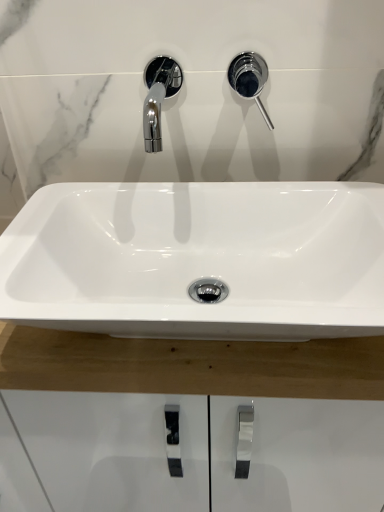
Question: Is polished chrome faucet at upper right surrounding white glossy sink at center?

Choices:
 (A) yes
 (B) no

Answer: (B)

Question: Can you confirm if polished chrome faucet at upper right is bigger than white glossy sink at center?

Choices:
 (A) yes
 (B) no

Answer: (B)

Question: Does polished chrome faucet at upper right turn towards white glossy sink at center?

Choices:
 (A) no
 (B) yes

Answer: (A)

Question: From a real-world perspective, is polished chrome faucet at upper right positioned under white glossy sink at center based on gravity?

Choices:
 (A) yes
 (B) no

Answer: (B)

Question: Can you confirm if polished chrome faucet at upper right is smaller than white glossy sink at center?

Choices:
 (A) no
 (B) yes

Answer: (B)

Question: From the image's perspective, is polished chrome faucet at upper right under white glossy sink at center?

Choices:
 (A) no
 (B) yes

Answer: (A)

Question: From a real-world perspective, is white glossy sink at center positioned over polished chrome faucet at upper right based on gravity?

Choices:
 (A) no
 (B) yes

Answer: (A)

Question: Is white glossy sink at center facing away from polished chrome faucet at upper right?

Choices:
 (A) yes
 (B) no

Answer: (B)

Question: Can you confirm if white glossy sink at center is thinner than polished chrome faucet at upper right?

Choices:
 (A) no
 (B) yes

Answer: (A)

Question: Are white glossy sink at center and polished chrome faucet at upper right making contact?

Choices:
 (A) no
 (B) yes

Answer: (A)

Question: Can you confirm if white glossy sink at center is smaller than polished chrome faucet at upper right?

Choices:
 (A) no
 (B) yes

Answer: (A)

Question: Are white glossy sink at center and polished chrome faucet at upper right located far from each other?

Choices:
 (A) yes
 (B) no

Answer: (B)

Question: Considering the positions of polished chrome faucet at upper right and white glossy sink at center in the image, is polished chrome faucet at upper right wider or thinner than white glossy sink at center?

Choices:
 (A) wide
 (B) thin

Answer: (B)